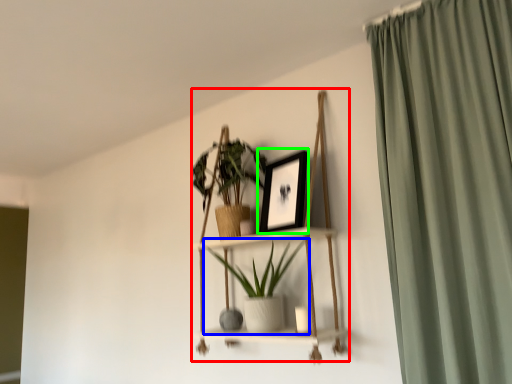
Question: Considering the real-world distances, which object is closest to cabinet (highlighted by a red box)? houseplant (highlighted by a blue box) or picture frame (highlighted by a green box).

Choices:
 (A) houseplant
 (B) picture frame

Answer: (A)